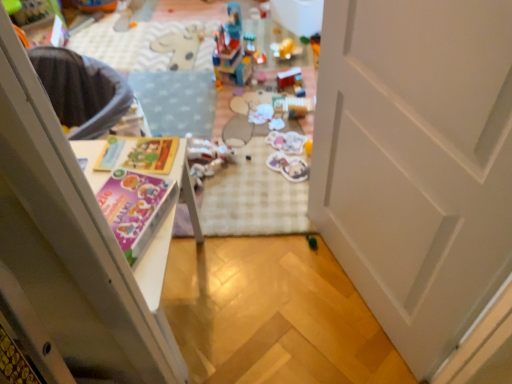
This screenshot has height=384, width=512. I want to click on free spot behind smooth plastic toy at center, arranged as the second toy when viewed from the top, so click(x=288, y=61).